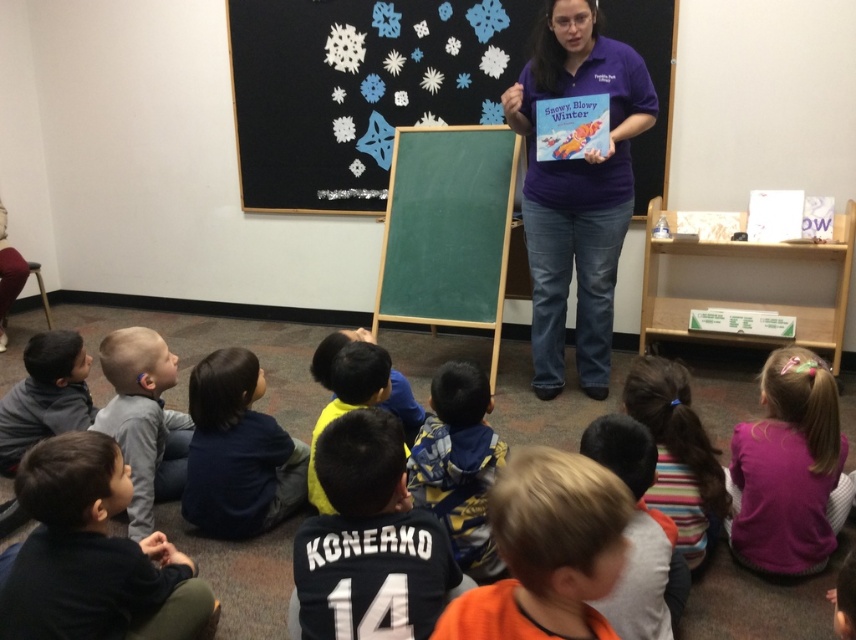
Question: Does dark blue sweater at lower left appear on the left side of dark blue jersey at center?

Choices:
 (A) yes
 (B) no

Answer: (A)

Question: Which of the following is the farthest from the observer?

Choices:
 (A) gray fleece jacket at lower left
 (B) blue and yellow jersey at center
 (C) dark blue sweater at lower left
 (D) purple cotton shirt at center

Answer: (D)

Question: Among these points, which one is farthest from the camera?

Choices:
 (A) (770, 369)
 (B) (401, 566)
 (C) (495, 552)

Answer: (A)

Question: Is paper snowflakes at upper center to the left of orange shirt at lower center from the viewer's perspective?

Choices:
 (A) yes
 (B) no

Answer: (A)

Question: Is purple cotton shirt at center closer to camera compared to matte paper book at center?

Choices:
 (A) no
 (B) yes

Answer: (B)

Question: Among these points, which one is nearest to the camera?

Choices:
 (A) (551, 534)
 (B) (688, 525)
 (C) (64, 540)
 (D) (182, 429)

Answer: (A)